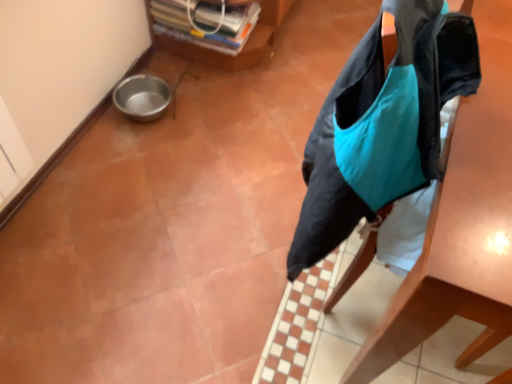
Measure the distance between point (208, 52) and camera.

The distance of point (208, 52) from camera is 2.16 meters.

Image resolution: width=512 pixels, height=384 pixels. What are the coordinates of `plastic transparent container at upper center, the first furniture from the left` in the screenshot? It's located at (244, 47).

Describe the element at coordinates (244, 47) in the screenshot. I see `plastic transparent container at upper center, the first furniture from the left` at that location.

Consider the image. Measure the distance between plastic transparent container at upper center, placed as the second furniture when sorted from right to left, and camera.

6.73 feet.

What do you see at coordinates (462, 221) in the screenshot?
I see `teal fabric bag at right, which is the first furniture from right to left` at bounding box center [462, 221].

Find the location of a particular element. The height and width of the screenshot is (384, 512). teal fabric bag at right, which is counted as the 2th furniture, starting from the left is located at coordinates (462, 221).

You are a GUI agent. You are given a task and a screenshot of the screen. Output one action in this format:
    pyautogui.click(x=<x>, y=<y>)
    Task: Click on the plastic transparent container at upper center, the first furniture from the left
    
    Given the screenshot: What is the action you would take?
    pyautogui.click(x=244, y=47)

Between teal fabric bag at right, which is counted as the 2th furniture, starting from the left, and plastic transparent container at upper center, placed as the second furniture when sorted from right to left, which one appears on the right side from the viewer's perspective?

Positioned to the right is teal fabric bag at right, which is counted as the 2th furniture, starting from the left.

Who is more distant, teal fabric bag at right, which is counted as the 2th furniture, starting from the left, or plastic transparent container at upper center, placed as the second furniture when sorted from right to left?

plastic transparent container at upper center, placed as the second furniture when sorted from right to left.

Considering the points (489, 111) and (240, 61), which point is in front, point (489, 111) or point (240, 61)?

Point (489, 111)

From the image's perspective, which is above, teal fabric bag at right, which is counted as the 2th furniture, starting from the left, or plastic transparent container at upper center, the first furniture from the left?

From the image's view, plastic transparent container at upper center, the first furniture from the left, is above.

From a real-world perspective, is teal fabric bag at right, which is counted as the 2th furniture, starting from the left, physically above plastic transparent container at upper center, placed as the second furniture when sorted from right to left?

Indeed, from a real-world perspective, teal fabric bag at right, which is counted as the 2th furniture, starting from the left, stands above plastic transparent container at upper center, placed as the second furniture when sorted from right to left.

Considering the relative sizes of teal fabric bag at right, which is counted as the 2th furniture, starting from the left, and plastic transparent container at upper center, the first furniture from the left, in the image provided, is teal fabric bag at right, which is counted as the 2th furniture, starting from the left, wider than plastic transparent container at upper center, the first furniture from the left,?

Yes.

Can you confirm if teal fabric bag at right, which is the first furniture from right to left, is taller than plastic transparent container at upper center, the first furniture from the left?

Correct, teal fabric bag at right, which is the first furniture from right to left, is much taller as plastic transparent container at upper center, the first furniture from the left.

Considering the relative sizes of teal fabric bag at right, which is counted as the 2th furniture, starting from the left, and plastic transparent container at upper center, placed as the second furniture when sorted from right to left, in the image provided, is teal fabric bag at right, which is counted as the 2th furniture, starting from the left, smaller than plastic transparent container at upper center, placed as the second furniture when sorted from right to left,?

Actually, teal fabric bag at right, which is counted as the 2th furniture, starting from the left, might be larger than plastic transparent container at upper center, placed as the second furniture when sorted from right to left.

Is teal fabric bag at right, which is counted as the 2th furniture, starting from the left, located outside plastic transparent container at upper center, the first furniture from the left?

Yes, teal fabric bag at right, which is counted as the 2th furniture, starting from the left, is outside of plastic transparent container at upper center, the first furniture from the left.

Is teal fabric bag at right, which is counted as the 2th furniture, starting from the left, directly adjacent to plastic transparent container at upper center, placed as the second furniture when sorted from right to left?

No.

Is teal fabric bag at right, which is counted as the 2th furniture, starting from the left, turned away from plastic transparent container at upper center, the first furniture from the left?

Yes, teal fabric bag at right, which is counted as the 2th furniture, starting from the left, is facing away from plastic transparent container at upper center, the first furniture from the left.

What's the angular difference between teal fabric bag at right, which is the first furniture from right to left, and plastic transparent container at upper center, the first furniture from the left,'s facing directions?

The angle between the facing direction of teal fabric bag at right, which is the first furniture from right to left, and the facing direction of plastic transparent container at upper center, the first furniture from the left, is 1.98 degrees.

In the image, there is a teal fabric bag at right, which is counted as the 2th furniture, starting from the left. At what (x,y) coordinates should I click in order to perform the action: click on furniture below it (from a real-world perspective). Please return your answer as a coordinate pair (x, y). The height and width of the screenshot is (384, 512). Looking at the image, I should click on click(244, 47).

Is plastic transparent container at upper center, the first furniture from the left, to the left or to the right of teal fabric bag at right, which is the first furniture from right to left, in the image?

plastic transparent container at upper center, the first furniture from the left, is to the left of teal fabric bag at right, which is the first furniture from right to left.

Looking at this image, does plastic transparent container at upper center, the first furniture from the left, lie in front of teal fabric bag at right, which is counted as the 2th furniture, starting from the left?

No, the depth of plastic transparent container at upper center, the first furniture from the left, is greater than that of teal fabric bag at right, which is counted as the 2th furniture, starting from the left.

Does point (263, 46) lie behind point (466, 144)?

That is True.

From the image's perspective, which one is positioned lower, plastic transparent container at upper center, the first furniture from the left, or teal fabric bag at right, which is counted as the 2th furniture, starting from the left?

teal fabric bag at right, which is counted as the 2th furniture, starting from the left, is shown below in the image.

From a real-world perspective, between plastic transparent container at upper center, the first furniture from the left, and teal fabric bag at right, which is counted as the 2th furniture, starting from the left, who is vertically lower?

plastic transparent container at upper center, the first furniture from the left, from a real-world perspective.

Looking at their sizes, would you say plastic transparent container at upper center, the first furniture from the left, is wider or thinner than teal fabric bag at right, which is the first furniture from right to left?

Considering their sizes, plastic transparent container at upper center, the first furniture from the left, looks slimmer than teal fabric bag at right, which is the first furniture from right to left.

Who is taller, plastic transparent container at upper center, placed as the second furniture when sorted from right to left, or teal fabric bag at right, which is the first furniture from right to left?

teal fabric bag at right, which is the first furniture from right to left, is taller.

Does plastic transparent container at upper center, the first furniture from the left, have a larger size compared to teal fabric bag at right, which is the first furniture from right to left?

Actually, plastic transparent container at upper center, the first furniture from the left, might be smaller than teal fabric bag at right, which is the first furniture from right to left.

Choose the correct answer: Is plastic transparent container at upper center, placed as the second furniture when sorted from right to left, inside teal fabric bag at right, which is counted as the 2th furniture, starting from the left, or outside it?

plastic transparent container at upper center, placed as the second furniture when sorted from right to left, is located beyond the bounds of teal fabric bag at right, which is counted as the 2th furniture, starting from the left.

Would you consider plastic transparent container at upper center, the first furniture from the left, to be distant from teal fabric bag at right, which is counted as the 2th furniture, starting from the left?

Yes.

Is plastic transparent container at upper center, placed as the second furniture when sorted from right to left, aimed at teal fabric bag at right, which is counted as the 2th furniture, starting from the left?

Yes, plastic transparent container at upper center, placed as the second furniture when sorted from right to left, is aimed at teal fabric bag at right, which is counted as the 2th furniture, starting from the left.

How many degrees apart are the facing directions of plastic transparent container at upper center, placed as the second furniture when sorted from right to left, and teal fabric bag at right, which is counted as the 2th furniture, starting from the left?

The angle between the facing direction of plastic transparent container at upper center, placed as the second furniture when sorted from right to left, and the facing direction of teal fabric bag at right, which is counted as the 2th furniture, starting from the left, is 1.98 degrees.

Could you measure the distance between plastic transparent container at upper center, placed as the second furniture when sorted from right to left, and teal fabric bag at right, which is counted as the 2th furniture, starting from the left?

plastic transparent container at upper center, placed as the second furniture when sorted from right to left, and teal fabric bag at right, which is counted as the 2th furniture, starting from the left, are 4.63 feet apart.

At what (x,y) coordinates should I click in order to perform the action: click on furniture on the left side of teal fabric bag at right, which is counted as the 2th furniture, starting from the left. Please return your answer as a coordinate pair (x, y). This screenshot has height=384, width=512. Looking at the image, I should click on (244, 47).

I want to click on furniture in front of the plastic transparent container at upper center, placed as the second furniture when sorted from right to left, so (x=462, y=221).

This screenshot has width=512, height=384. In the image, there is a teal fabric bag at right, which is counted as the 2th furniture, starting from the left. In order to click on furniture above it (from the image's perspective) in this screenshot , I will do `click(244, 47)`.